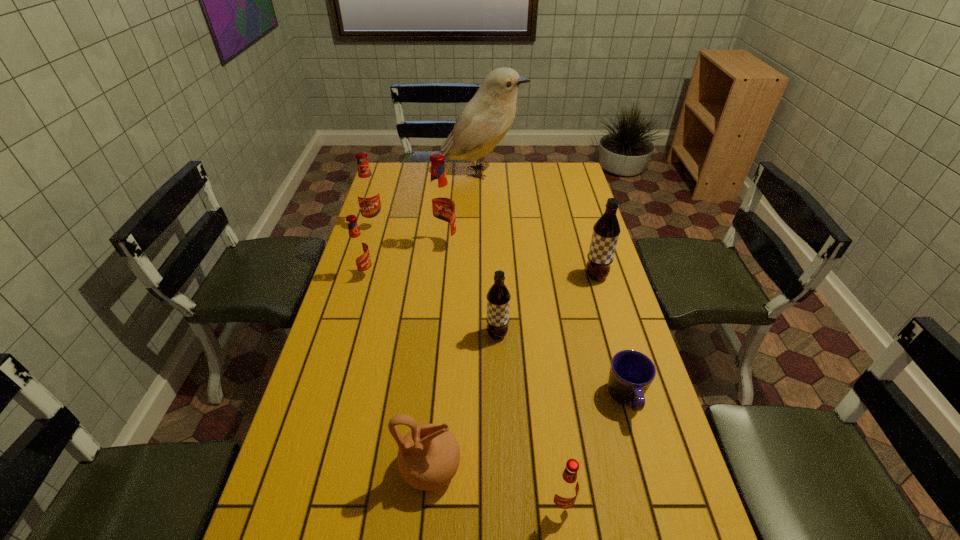
This screenshot has width=960, height=540. In order to click on the tallest object in this screenshot , I will do [x=483, y=122].

I want to click on the farthest object, so click(483, 122).

Identify the location of the tallest root beer. This screenshot has height=540, width=960. (440, 205).

Image resolution: width=960 pixels, height=540 pixels. In order to click on the third red root beer from left to right in this screenshot , I will do `click(440, 205)`.

You are a GUI agent. You are given a task and a screenshot of the screen. Output one action in this format:
    pyautogui.click(x=<x>, y=<y>)
    Task: Click on the third smallest red root beer
    The image size is (960, 540).
    Given the screenshot: What is the action you would take?
    pyautogui.click(x=368, y=194)

You are a GUI agent. You are given a task and a screenshot of the screen. Output one action in this format:
    pyautogui.click(x=<x>, y=<y>)
    Task: Click on the second farthest object
    Image resolution: width=960 pixels, height=540 pixels.
    Given the screenshot: What is the action you would take?
    pyautogui.click(x=368, y=194)

Find the location of a particular element. The image size is (960, 540). the rightmost root beer is located at coordinates (606, 230).

Find the location of a particular element. the bigger brown root beer is located at coordinates (606, 230).

The image size is (960, 540). Find the location of `the third farthest red root beer`. the third farthest red root beer is located at coordinates (357, 247).

This screenshot has height=540, width=960. I want to click on the smaller brown root beer, so click(498, 297).